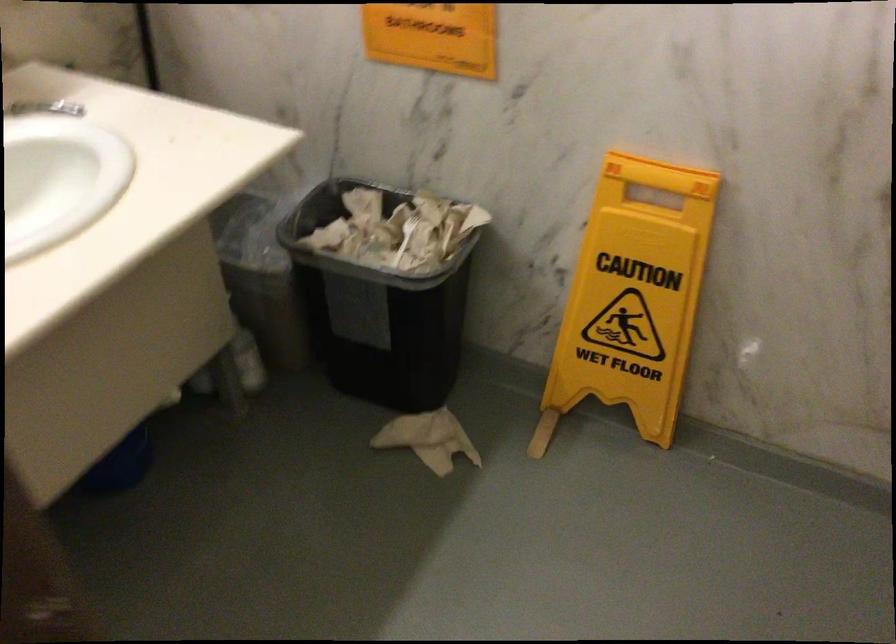
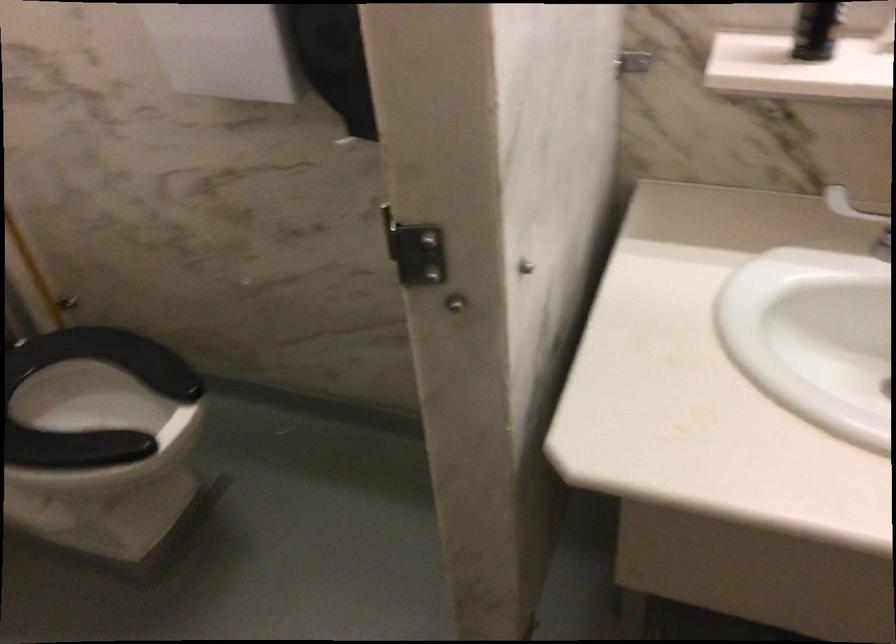
How did the camera likely rotate?

The rotation direction of the camera is left-down.